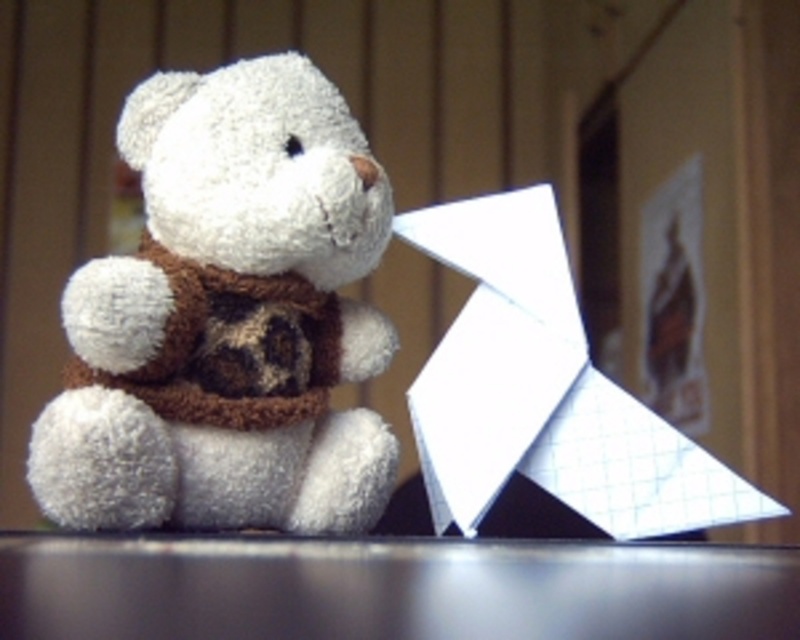
You are a child who wants to place the white paper at right onto the black glossy table at lower center. Can you do so without any obstruction?

The black glossy table at lower center is located below white paper at right, so yes, you can place the white paper at right onto the black glossy table at lower center since it is positioned below.

You are organizing a child birthday party and need to place a birthday card on the table. The white plush teddy bear at center is already there. Can you place the white paper at right behind the teddy bear so it won t be seen?

The white plush teddy bear at center is in front of the white paper at right, so placing the white paper at right behind the teddy bear would make it less visible from the front. However, since the teddy bear is already positioned in front, the paper would be obscured from view when looking directly at the bear.